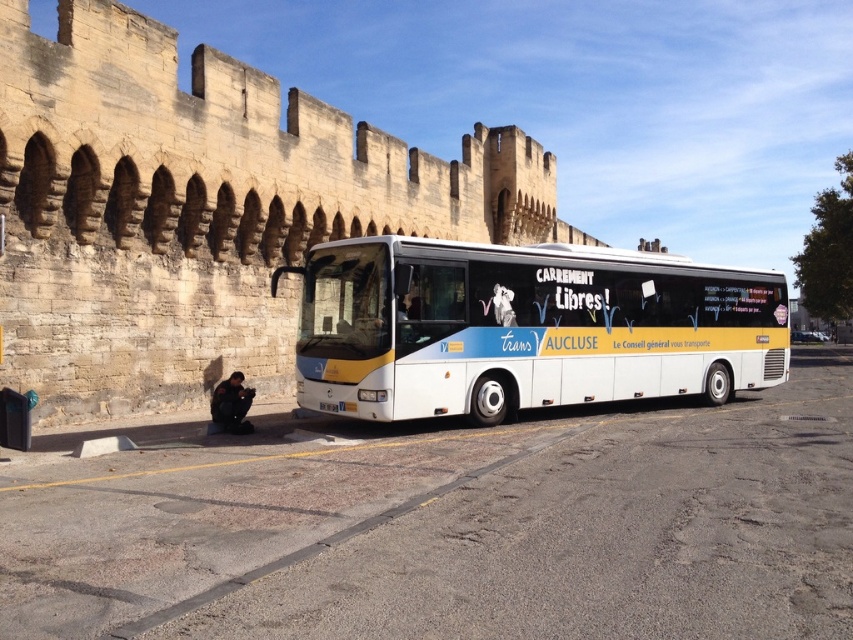
Measure the distance between point (122, 256) and camera.

The distance of point (122, 256) from camera is 14.78 meters.

Which is behind, point (126, 147) or point (345, 253)?

Point (126, 147)

Describe the element at coordinates (198, 209) in the screenshot. The image size is (853, 640). I see `stone wall at center` at that location.

Identify the location of stone wall at center. This screenshot has width=853, height=640. (198, 209).

Is stone wall at center thinner than smooth black surface at lower left?

No.

At what (x,y) coordinates should I click in order to perform the action: click on stone wall at center. Please return your answer as a coordinate pair (x, y). Image resolution: width=853 pixels, height=640 pixels. Looking at the image, I should click on (198, 209).

Does white glossy bus at center appear on the left side of smooth black surface at lower left?

In fact, white glossy bus at center is to the right of smooth black surface at lower left.

Is point (409, 312) positioned before point (28, 432)?

No, (409, 312) is behind (28, 432).

Where is `white glossy bus at center`? white glossy bus at center is located at coordinates (524, 326).